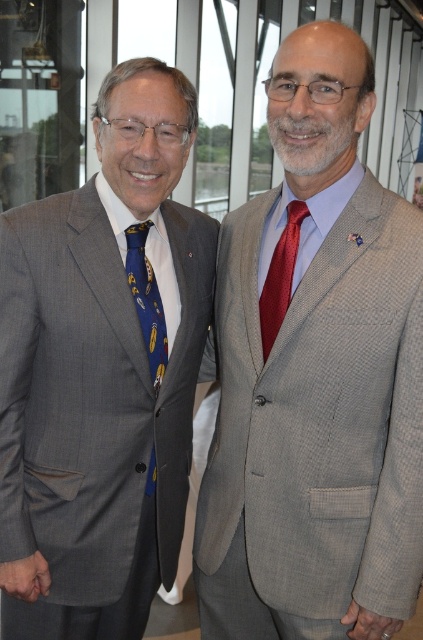
Question: Is matte gray suit at center above blue silk tie at left?

Choices:
 (A) no
 (B) yes

Answer: (A)

Question: Can you confirm if matte gray suit at center is positioned below matte gray suit at left?

Choices:
 (A) no
 (B) yes

Answer: (A)

Question: Which point is closer to the camera?

Choices:
 (A) (280, 316)
 (B) (145, 308)

Answer: (A)

Question: Is matte gray suit at center thinner than matte gray suit at left?

Choices:
 (A) no
 (B) yes

Answer: (B)

Question: Estimate the real-world distances between objects in this image. Which object is closer to the matte gray suit at center?

Choices:
 (A) shiny red tie at center
 (B) blue silk tie at left

Answer: (A)

Question: Which point is closer to the camera taking this photo?

Choices:
 (A) (279, 269)
 (B) (176, 298)
 (C) (164, 355)
 (D) (222, 588)

Answer: (A)